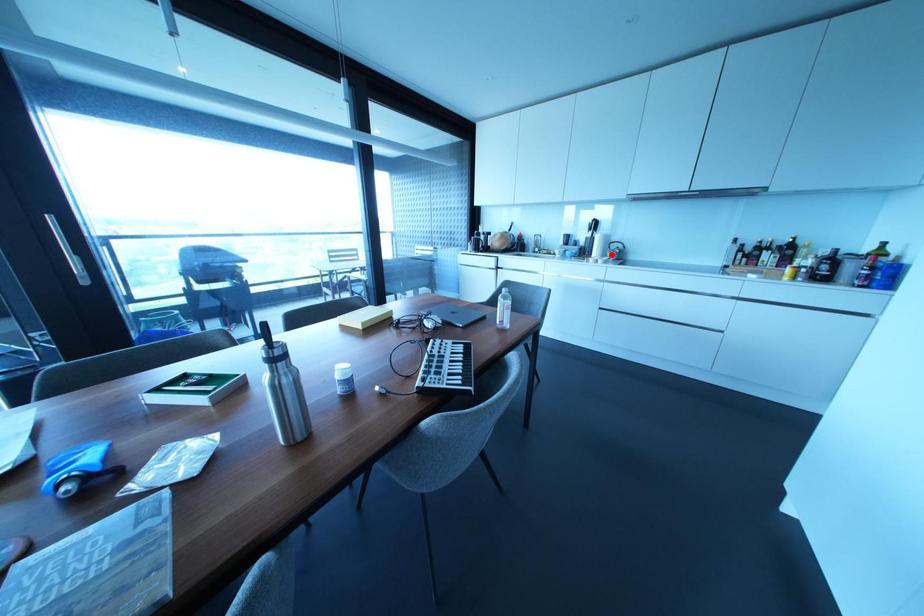
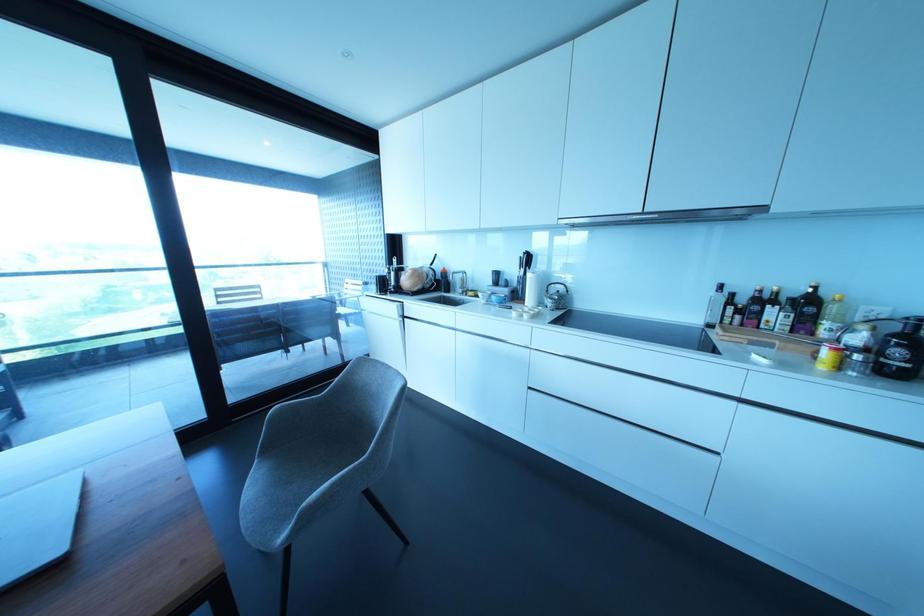
In the second image, find the point that corresponds to the highlighted location in the first image.

(549, 302)